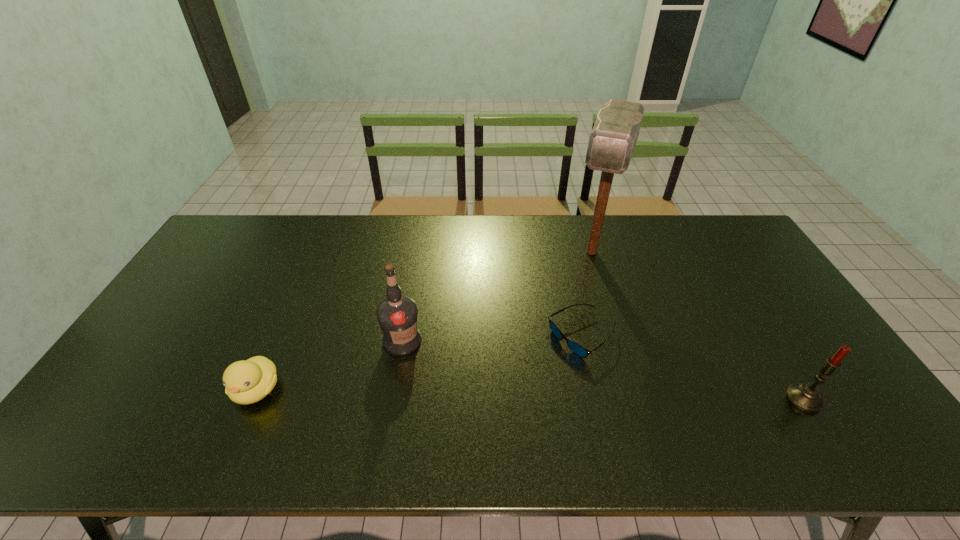
You are a GUI agent. You are given a task and a screenshot of the screen. Output one action in this format:
    pyautogui.click(x=<x>, y=<y>)
    Task: Click on the vacant position in the image that satisfies the following two spatial constraints: 1. on the front side of the sunglasses; 2. on the right side of the candle
    
    Given the screenshot: What is the action you would take?
    pyautogui.click(x=596, y=399)

You are a GUI agent. You are given a task and a screenshot of the screen. Output one action in this format:
    pyautogui.click(x=<x>, y=<y>)
    Task: Click on the free space that satisfies the following two spatial constraints: 1. at the beak of the second shortest object; 2. on the left side of the third shortest object
    The width and height of the screenshot is (960, 540).
    Given the screenshot: What is the action you would take?
    [x=252, y=399]

Locate an element on the screen. vacant space that satisfies the following two spatial constraints: 1. on the front side of the tallest object; 2. on the right side of the third tallest object is located at coordinates (636, 399).

The image size is (960, 540). I want to click on free point that satisfies the following two spatial constraints: 1. at the beak of the leftmost object; 2. on the left side of the rightmost object, so [x=252, y=399].